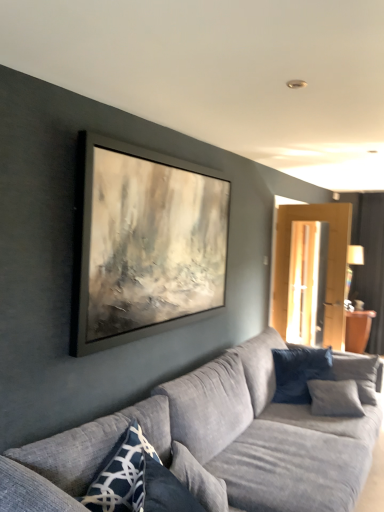
Locate an element on the screen. blue textured pillow at lower left, the 1th pillow when ordered from left to right is located at coordinates (121, 475).

The height and width of the screenshot is (512, 384). Describe the element at coordinates (299, 372) in the screenshot. I see `dark blue fabric pillow at right, positioned as the 1th pillow in back-to-front order` at that location.

Identify the location of dark blue textured pillow at right, which ranks as the third pillow in left-to-right order. (358, 373).

What do you see at coordinates (358, 373) in the screenshot?
I see `dark blue textured pillow at right, which appears as the 2th pillow when viewed from the back` at bounding box center [358, 373].

Measure the distance between textured gray couch at center and camera.

textured gray couch at center is 1.32 meters away from camera.

Identify the location of blue textured pillow at lower left, the 1th pillow when ordered from left to right. (121, 475).

Is dark blue textured pillow at right, which ranks as the third pillow in left-to-right order, at the left side of textured gray couch at center?

In fact, dark blue textured pillow at right, which ranks as the third pillow in left-to-right order, is to the right of textured gray couch at center.

Considering the sizes of dark blue textured pillow at right, which appears as the 2th pillow when viewed from the back, and textured gray couch at center in the image, is dark blue textured pillow at right, which appears as the 2th pillow when viewed from the back, taller or shorter than textured gray couch at center?

Considering their sizes, dark blue textured pillow at right, which appears as the 2th pillow when viewed from the back, has less height than textured gray couch at center.

Considering the relative sizes of dark blue textured pillow at right, the first pillow when ordered from right to left, and textured gray couch at center in the image provided, is dark blue textured pillow at right, the first pillow when ordered from right to left, bigger than textured gray couch at center?

No, dark blue textured pillow at right, the first pillow when ordered from right to left, is not bigger than textured gray couch at center.

Between dark blue textured pillow at right, which is the 2th pillow in front-to-back order, and textured gray couch at center, which one is positioned behind?

Positioned behind is dark blue textured pillow at right, which is the 2th pillow in front-to-back order.

From the picture: Is dark blue textured pillow at right, which ranks as the third pillow in left-to-right order, facing towards dark blue fabric pillow at right, the second pillow positioned from the right?

Yes, dark blue textured pillow at right, which ranks as the third pillow in left-to-right order, faces towards dark blue fabric pillow at right, the second pillow positioned from the right.

From a real-world perspective, is dark blue textured pillow at right, which is the 2th pillow in front-to-back order, above or below dark blue fabric pillow at right, positioned as the third pillow in front-to-back order?

From a real-world perspective, dark blue textured pillow at right, which is the 2th pillow in front-to-back order, is physically above dark blue fabric pillow at right, positioned as the third pillow in front-to-back order.

Between point (369, 381) and point (294, 380), which one is positioned behind?

The point (294, 380) is farther.

Considering the relative positions of dark blue textured pillow at right, the first pillow when ordered from right to left, and dark blue fabric pillow at right, acting as the second pillow starting from the left, in the image provided, is dark blue textured pillow at right, the first pillow when ordered from right to left, to the right of dark blue fabric pillow at right, acting as the second pillow starting from the left, from the viewer's perspective?

Indeed, dark blue textured pillow at right, the first pillow when ordered from right to left, is positioned on the right side of dark blue fabric pillow at right, acting as the second pillow starting from the left.

From the image's perspective, which one is positioned lower, blue textured pillow at lower left, which ranks as the third pillow in back-to-front order, or dark blue fabric pillow at right, acting as the second pillow starting from the left?

From the image's view, dark blue fabric pillow at right, acting as the second pillow starting from the left, is below.

Is there a large distance between blue textured pillow at lower left, which appears as the first pillow when viewed from the front, and dark blue fabric pillow at right, the second pillow positioned from the right?

Yes, blue textured pillow at lower left, which appears as the first pillow when viewed from the front, and dark blue fabric pillow at right, the second pillow positioned from the right, are located far from each other.

Is blue textured pillow at lower left, which ranks as the third pillow in back-to-front order, turned away from dark blue fabric pillow at right, the second pillow positioned from the right?

blue textured pillow at lower left, which ranks as the third pillow in back-to-front order, is not turned away from dark blue fabric pillow at right, the second pillow positioned from the right.

Considering the positions of points (137, 473) and (369, 396), is point (137, 473) farther from camera compared to point (369, 396)?

No, (137, 473) is closer to viewer.

Considering the relative positions of blue textured pillow at lower left, the 1th pillow when ordered from left to right, and dark blue textured pillow at right, the first pillow when ordered from right to left, in the image provided, is blue textured pillow at lower left, the 1th pillow when ordered from left to right, to the left or to the right of dark blue textured pillow at right, the first pillow when ordered from right to left,?

Based on their positions, blue textured pillow at lower left, the 1th pillow when ordered from left to right, is located to the left of dark blue textured pillow at right, the first pillow when ordered from right to left.

Considering the sizes of blue textured pillow at lower left, which ranks as the third pillow in back-to-front order, and dark blue textured pillow at right, which ranks as the third pillow in left-to-right order, in the image, is blue textured pillow at lower left, which ranks as the third pillow in back-to-front order, wider or thinner than dark blue textured pillow at right, which ranks as the third pillow in left-to-right order,?

Considering their sizes, blue textured pillow at lower left, which ranks as the third pillow in back-to-front order, looks slimmer than dark blue textured pillow at right, which ranks as the third pillow in left-to-right order.

Is blue textured pillow at lower left, which ranks as the third pillow in back-to-front order, positioned with its back to dark blue textured pillow at right, which appears as the 2th pillow when viewed from the back?

No, blue textured pillow at lower left, which ranks as the third pillow in back-to-front order, is not facing away from dark blue textured pillow at right, which appears as the 2th pillow when viewed from the back.

Is dark blue fabric pillow at right, the second pillow positioned from the right, positioned in front of dark blue textured pillow at right, which appears as the 2th pillow when viewed from the back?

No, it is not.

Looking at this image, from the image's perspective, is dark blue fabric pillow at right, acting as the second pillow starting from the left, located above dark blue textured pillow at right, which is the 2th pillow in front-to-back order?

No, from the image's perspective, dark blue fabric pillow at right, acting as the second pillow starting from the left, is not over dark blue textured pillow at right, which is the 2th pillow in front-to-back order.

Is dark blue fabric pillow at right, positioned as the third pillow in front-to-back order, far away from dark blue textured pillow at right, which ranks as the third pillow in left-to-right order?

No, dark blue fabric pillow at right, positioned as the third pillow in front-to-back order, is not far from dark blue textured pillow at right, which ranks as the third pillow in left-to-right order.

Looking at this image, between dark blue fabric pillow at right, the second pillow positioned from the right, and dark blue textured pillow at right, which ranks as the third pillow in left-to-right order, which one has more height?

Standing taller between the two is dark blue textured pillow at right, which ranks as the third pillow in left-to-right order.

Considering the sizes of dark blue textured pillow at right, the first pillow when ordered from right to left, and blue textured pillow at lower left, the 1th pillow when ordered from left to right, in the image, is dark blue textured pillow at right, the first pillow when ordered from right to left, taller or shorter than blue textured pillow at lower left, the 1th pillow when ordered from left to right,?

Clearly, dark blue textured pillow at right, the first pillow when ordered from right to left, is taller compared to blue textured pillow at lower left, the 1th pillow when ordered from left to right.

Considering the positions of objects dark blue textured pillow at right, which appears as the 2th pillow when viewed from the back, and blue textured pillow at lower left, which ranks as the third pillow in back-to-front order, in the image provided, who is behind, dark blue textured pillow at right, which appears as the 2th pillow when viewed from the back, or blue textured pillow at lower left, which ranks as the third pillow in back-to-front order,?

dark blue textured pillow at right, which appears as the 2th pillow when viewed from the back, is behind.

Is dark blue textured pillow at right, which appears as the 2th pillow when viewed from the back, not inside blue textured pillow at lower left, which appears as the first pillow when viewed from the front?

dark blue textured pillow at right, which appears as the 2th pillow when viewed from the back, lies outside blue textured pillow at lower left, which appears as the first pillow when viewed from the front,'s area.

Locate an element on the screen. This screenshot has width=384, height=512. the 2nd pillow to the left of the dark blue textured pillow at right, the first pillow when ordered from right to left, starting your count from the anchor is located at coordinates (121, 475).

Consider the image. Which of these two, textured gray couch at center or blue textured pillow at lower left, which ranks as the third pillow in back-to-front order, is smaller?

blue textured pillow at lower left, which ranks as the third pillow in back-to-front order.

From the picture: Is textured gray couch at center looking in the opposite direction of blue textured pillow at lower left, the 1th pillow when ordered from left to right?

Absolutely, textured gray couch at center is directed away from blue textured pillow at lower left, the 1th pillow when ordered from left to right.

Considering the sizes of textured gray couch at center and blue textured pillow at lower left, the third pillow from the right, in the image, is textured gray couch at center wider or thinner than blue textured pillow at lower left, the third pillow from the right,?

In the image, textured gray couch at center appears to be wider than blue textured pillow at lower left, the third pillow from the right.

Between textured gray couch at center and blue textured pillow at lower left, the third pillow from the right, which one has less height?

blue textured pillow at lower left, the third pillow from the right, is shorter.

At what (x,y) coordinates should I click in order to perform the action: click on the 3rd pillow above when counting from the textured gray couch at center (from the image's perspective). Please return your answer as a coordinate pair (x, y). The height and width of the screenshot is (512, 384). Looking at the image, I should click on (358, 373).

Where is `pillow on the right of dark blue fabric pillow at right, positioned as the third pillow in front-to-back order`? pillow on the right of dark blue fabric pillow at right, positioned as the third pillow in front-to-back order is located at coordinates (358, 373).

Based on the photo, which object lies further to the anchor point dark blue textured pillow at right, which appears as the 2th pillow when viewed from the back, blue textured pillow at lower left, which ranks as the third pillow in back-to-front order, or dark blue fabric pillow at right, acting as the second pillow starting from the left?

Among the two, blue textured pillow at lower left, which ranks as the third pillow in back-to-front order, is located further to dark blue textured pillow at right, which appears as the 2th pillow when viewed from the back.

Looking at the image, which one is located closer to dark blue textured pillow at right, the first pillow when ordered from right to left, textured gray couch at center or blue textured pillow at lower left, which appears as the first pillow when viewed from the front?

textured gray couch at center.

In the scene shown: Considering their positions, is dark blue fabric pillow at right, positioned as the 1th pillow in back-to-front order, positioned further to textured gray couch at center than dark blue textured pillow at right, which is the 2th pillow in front-to-back order?

dark blue textured pillow at right, which is the 2th pillow in front-to-back order.

Based on their spatial positions, is blue textured pillow at lower left, which ranks as the third pillow in back-to-front order, or textured gray couch at center further from dark blue fabric pillow at right, positioned as the third pillow in front-to-back order?

blue textured pillow at lower left, which ranks as the third pillow in back-to-front order, is positioned further to the anchor dark blue fabric pillow at right, positioned as the third pillow in front-to-back order.

When comparing their distances from dark blue fabric pillow at right, the second pillow positioned from the right, does textured gray couch at center or blue textured pillow at lower left, which appears as the first pillow when viewed from the front, seem further?

The object further to dark blue fabric pillow at right, the second pillow positioned from the right, is blue textured pillow at lower left, which appears as the first pillow when viewed from the front.

Consider the image. Looking at the image, which one is located further to blue textured pillow at lower left, which ranks as the third pillow in back-to-front order, dark blue fabric pillow at right, the second pillow positioned from the right, or dark blue textured pillow at right, which ranks as the third pillow in left-to-right order?

dark blue textured pillow at right, which ranks as the third pillow in left-to-right order, lies further to blue textured pillow at lower left, which ranks as the third pillow in back-to-front order, than the other object.

Looking at the image, which one is located further to blue textured pillow at lower left, which appears as the first pillow when viewed from the front, dark blue textured pillow at right, which appears as the 2th pillow when viewed from the back, or textured gray couch at center?

dark blue textured pillow at right, which appears as the 2th pillow when viewed from the back.

Which object lies further to the anchor point blue textured pillow at lower left, which ranks as the third pillow in back-to-front order, textured gray couch at center or dark blue fabric pillow at right, positioned as the 1th pillow in back-to-front order?

The object further to blue textured pillow at lower left, which ranks as the third pillow in back-to-front order, is dark blue fabric pillow at right, positioned as the 1th pillow in back-to-front order.

This screenshot has width=384, height=512. Identify the location of pillow located between blue textured pillow at lower left, which ranks as the third pillow in back-to-front order, and dark blue fabric pillow at right, positioned as the 1th pillow in back-to-front order, in the depth direction. (358, 373).

This screenshot has width=384, height=512. Identify the location of pillow between textured gray couch at center and dark blue textured pillow at right, which is the 2th pillow in front-to-back order, in the front-back direction. (121, 475).